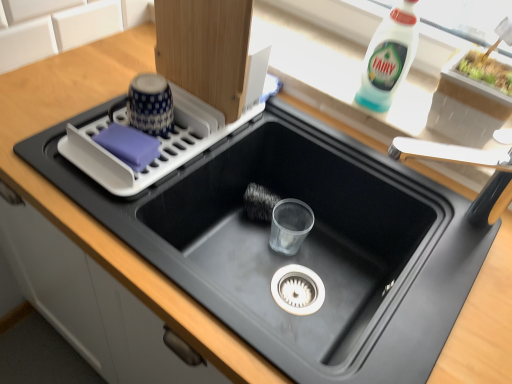
I want to click on free space in front of white plastic dish rack at upper left, so click(x=130, y=218).